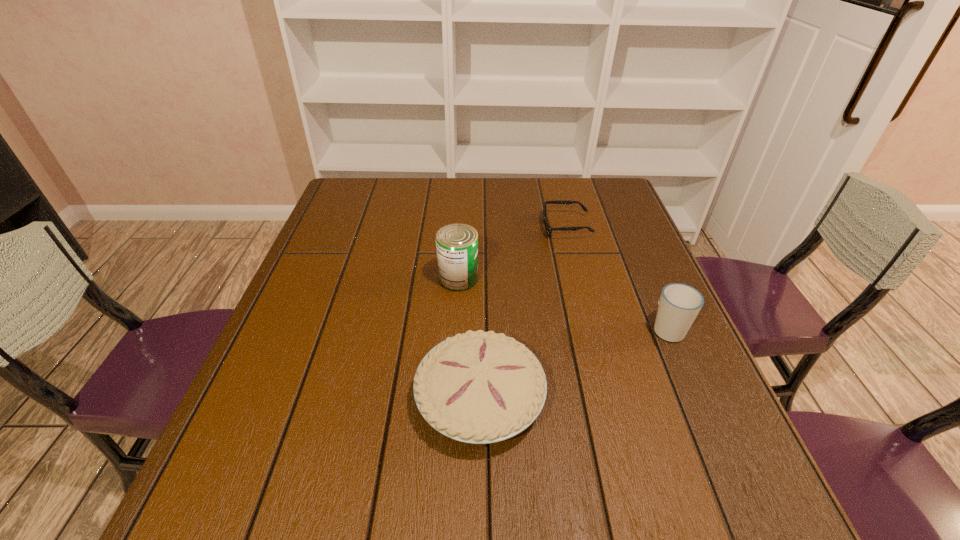
The image size is (960, 540). What are the coordinates of `the second farthest object` in the screenshot? It's located at (456, 244).

The image size is (960, 540). I want to click on the tallest object, so click(x=456, y=244).

Image resolution: width=960 pixels, height=540 pixels. Identify the location of the second nearest object. (679, 304).

What are the coordinates of `the rightmost object` in the screenshot? It's located at (679, 304).

Where is `pie`? pie is located at coordinates (479, 387).

What are the coordinates of `the second shortest object` in the screenshot? It's located at 479,387.

The height and width of the screenshot is (540, 960). What are the coordinates of `the farthest object` in the screenshot? It's located at 549,229.

This screenshot has height=540, width=960. In order to click on sunglasses in this screenshot , I will do `click(549, 229)`.

Find the location of a particular element. Image resolution: width=960 pixels, height=540 pixels. vacant region located on the front of the tallest object is located at coordinates (456, 315).

Find the location of a particular element. free space located 0.400m with a handle on the side of the third farthest object is located at coordinates (620, 218).